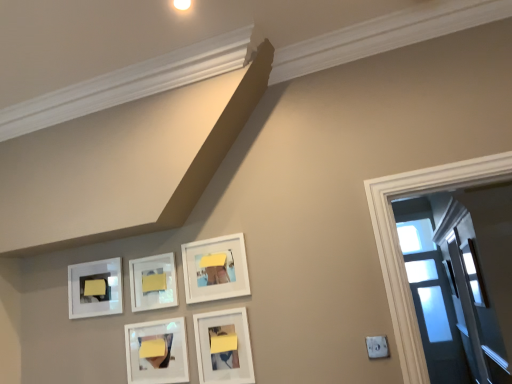
Locate an element on the screen. The width and height of the screenshot is (512, 384). matte white picture frame at lower center, which is counted as the first picture frame, starting from the right is located at coordinates (223, 347).

What do you see at coordinates (153, 282) in the screenshot? I see `white matte picture frame at center, positioned as the 2th picture frame in left-to-right order` at bounding box center [153, 282].

You are a GUI agent. You are given a task and a screenshot of the screen. Output one action in this format:
    pyautogui.click(x=<x>, y=<y>)
    Task: Click on the matte yellow paper at upper left, positioned as the first furniture in back-to-front order
    The width and height of the screenshot is (512, 384).
    Given the screenshot: What is the action you would take?
    pyautogui.click(x=95, y=287)

Image resolution: width=512 pixels, height=384 pixels. Describe the element at coordinates (473, 273) in the screenshot. I see `clear glass window at right` at that location.

The width and height of the screenshot is (512, 384). What do you see at coordinates (215, 269) in the screenshot?
I see `white matte picture frame at upper center, the 2th picture frame when ordered from right to left` at bounding box center [215, 269].

The image size is (512, 384). I want to click on matte white picture frame at lower center, the 3th picture frame when ordered from left to right, so click(157, 351).

This screenshot has width=512, height=384. What do you see at coordinates (154, 282) in the screenshot?
I see `yellow matte paper at center, the first furniture viewed from the right` at bounding box center [154, 282].

Identify the location of matte white picture frame at lower center, which is counted as the first picture frame, starting from the right. The image size is (512, 384). (223, 347).

From the image's perspective, is white matte picture frame at upper left, the 5th picture frame when ordered from right to left, beneath matte white picture frame at lower center, the 3th picture frame when ordered from left to right?

No.

Considering the relative sizes of white matte picture frame at upper left, the 5th picture frame when ordered from right to left, and matte white picture frame at lower center, which appears as the 3th picture frame when viewed from the right, in the image provided, is white matte picture frame at upper left, the 5th picture frame when ordered from right to left, thinner than matte white picture frame at lower center, which appears as the 3th picture frame when viewed from the right,?

Yes, white matte picture frame at upper left, the 5th picture frame when ordered from right to left, is thinner than matte white picture frame at lower center, which appears as the 3th picture frame when viewed from the right.

Who is more distant, white matte picture frame at upper left, the 5th picture frame when ordered from right to left, or matte white picture frame at lower center, the 3th picture frame when ordered from left to right?

white matte picture frame at upper left, the 5th picture frame when ordered from right to left.

Does matte yellow paper at upper left, positioned as the first furniture in back-to-front order, contain matte white picture frame at lower center, which is counted as the first picture frame, starting from the right?

No, matte white picture frame at lower center, which is counted as the first picture frame, starting from the right, is not surrounded by matte yellow paper at upper left, positioned as the first furniture in back-to-front order.

From the image's perspective, which one is positioned lower, matte yellow paper at upper left, which ranks as the 2th furniture in right-to-left order, or matte white picture frame at lower center, the fifth picture frame when ordered from left to right?

matte white picture frame at lower center, the fifth picture frame when ordered from left to right, from the image's perspective.

How many degrees apart are the facing directions of matte yellow paper at upper left, which ranks as the 2th furniture in right-to-left order, and matte white picture frame at lower center, which is counted as the first picture frame, starting from the right?

The angle between the facing direction of matte yellow paper at upper left, which ranks as the 2th furniture in right-to-left order, and the facing direction of matte white picture frame at lower center, which is counted as the first picture frame, starting from the right, is 0.293 degrees.

Considering the sizes of objects matte yellow paper at upper left, positioned as the first furniture in back-to-front order, and matte white picture frame at lower center, which is counted as the first picture frame, starting from the right, in the image provided, who is wider, matte yellow paper at upper left, positioned as the first furniture in back-to-front order, or matte white picture frame at lower center, which is counted as the first picture frame, starting from the right,?

Wider between the two is matte white picture frame at lower center, which is counted as the first picture frame, starting from the right.

Is matte white picture frame at lower center, which appears as the 3th picture frame when viewed from the right, not near white matte picture frame at upper left, the 1th picture frame positioned from the left?

matte white picture frame at lower center, which appears as the 3th picture frame when viewed from the right, is near white matte picture frame at upper left, the 1th picture frame positioned from the left, not far away.

Is matte white picture frame at lower center, which appears as the 3th picture frame when viewed from the right, bigger than white matte picture frame at upper left, the 5th picture frame when ordered from right to left?

Yes.

Considering the relative positions of matte white picture frame at lower center, which appears as the 3th picture frame when viewed from the right, and white matte picture frame at upper left, the 5th picture frame when ordered from right to left, in the image provided, is matte white picture frame at lower center, which appears as the 3th picture frame when viewed from the right, to the right of white matte picture frame at upper left, the 5th picture frame when ordered from right to left, from the viewer's perspective?

Yes, matte white picture frame at lower center, which appears as the 3th picture frame when viewed from the right, is to the right of white matte picture frame at upper left, the 5th picture frame when ordered from right to left.

From the image's perspective, would you say transparent glass door at right is positioned over matte white picture frame at lower center, the fifth picture frame when ordered from left to right?

No, from the image's perspective, transparent glass door at right is not over matte white picture frame at lower center, the fifth picture frame when ordered from left to right.

Is transparent glass door at right spatially inside matte white picture frame at lower center, which is counted as the first picture frame, starting from the right, or outside of it?

transparent glass door at right exists outside the volume of matte white picture frame at lower center, which is counted as the first picture frame, starting from the right.

Considering the positions of objects transparent glass door at right and matte white picture frame at lower center, which is counted as the first picture frame, starting from the right, in the image provided, who is in front, transparent glass door at right or matte white picture frame at lower center, which is counted as the first picture frame, starting from the right,?

matte white picture frame at lower center, which is counted as the first picture frame, starting from the right, is closer to the camera.

Would you say yellow matte paper at center, which is counted as the 2th furniture, starting from the back, is inside or outside white matte picture frame at center, the fourth picture frame when ordered from right to left?

yellow matte paper at center, which is counted as the 2th furniture, starting from the back, fits inside white matte picture frame at center, the fourth picture frame when ordered from right to left.

Could you measure the distance between yellow matte paper at center, the first furniture viewed from the right, and white matte picture frame at center, positioned as the 2th picture frame in left-to-right order?

yellow matte paper at center, the first furniture viewed from the right, is 1.36 inches away from white matte picture frame at center, positioned as the 2th picture frame in left-to-right order.

Locate an element on the screen. Image resolution: width=512 pixels, height=384 pixels. picture frame that is the 1st object to the left of the yellow matte paper at center, the second furniture positioned from the left, starting at the anchor is located at coordinates (153, 282).

Is yellow matte paper at center, the second furniture positioned from the left, next to white matte picture frame at center, positioned as the 2th picture frame in left-to-right order?

Yes, yellow matte paper at center, the second furniture positioned from the left, is right next to white matte picture frame at center, positioned as the 2th picture frame in left-to-right order, and making contact.

From a real-world perspective, which picture frame is the 1st one above the white matte picture frame at center, the fourth picture frame when ordered from right to left? Please provide its 2D coordinates.

[(215, 269)]

Can white matte picture frame at center, positioned as the 2th picture frame in left-to-right order, be found inside white matte picture frame at upper center, the 4th picture frame positioned from the left?

No, white matte picture frame at center, positioned as the 2th picture frame in left-to-right order, is not inside white matte picture frame at upper center, the 4th picture frame positioned from the left.

Considering the relative positions of white matte picture frame at upper center, the 2th picture frame when ordered from right to left, and white matte picture frame at center, the fourth picture frame when ordered from right to left, in the image provided, is white matte picture frame at upper center, the 2th picture frame when ordered from right to left, to the right of white matte picture frame at center, the fourth picture frame when ordered from right to left, from the viewer's perspective?

Indeed, white matte picture frame at upper center, the 2th picture frame when ordered from right to left, is positioned on the right side of white matte picture frame at center, the fourth picture frame when ordered from right to left.

How different are the orientations of white matte picture frame at center, positioned as the 2th picture frame in left-to-right order, and white matte picture frame at upper center, the 4th picture frame positioned from the left, in degrees?

The facing directions of white matte picture frame at center, positioned as the 2th picture frame in left-to-right order, and white matte picture frame at upper center, the 4th picture frame positioned from the left, are 0.0004 degrees apart.

Is white matte picture frame at center, the fourth picture frame when ordered from right to left, to the left of white matte picture frame at upper center, the 2th picture frame when ordered from right to left, from the viewer's perspective?

Yes, white matte picture frame at center, the fourth picture frame when ordered from right to left, is to the left of white matte picture frame at upper center, the 2th picture frame when ordered from right to left.

Is white matte picture frame at center, positioned as the 2th picture frame in left-to-right order, further to the viewer compared to white matte picture frame at upper center, the 2th picture frame when ordered from right to left?

Yes, the depth of white matte picture frame at center, positioned as the 2th picture frame in left-to-right order, is greater than that of white matte picture frame at upper center, the 2th picture frame when ordered from right to left.

From a real-world perspective, is white matte picture frame at center, positioned as the 2th picture frame in left-to-right order, on top of white matte picture frame at upper center, the 4th picture frame positioned from the left?

No, from a real-world perspective, white matte picture frame at center, positioned as the 2th picture frame in left-to-right order, is not above white matte picture frame at upper center, the 4th picture frame positioned from the left.

At what (x,y) coordinates should I click in order to perform the action: click on picture frame that is the 2nd object located below the white matte picture frame at upper left, the 1th picture frame positioned from the left (from the image's perspective). Please return your answer as a coordinate pair (x, y). The image size is (512, 384). Looking at the image, I should click on click(157, 351).

From a real-world perspective, count 2nd furnitures upward from the matte white picture frame at lower center, which is counted as the first picture frame, starting from the right, and point to it. Please provide its 2D coordinates.

[(95, 287)]

When comparing their distances from white matte picture frame at center, positioned as the 2th picture frame in left-to-right order, does matte white picture frame at lower center, which appears as the 3th picture frame when viewed from the right, or matte white picture frame at lower center, the fifth picture frame when ordered from left to right, seem further?

matte white picture frame at lower center, the fifth picture frame when ordered from left to right, is positioned further to the anchor white matte picture frame at center, positioned as the 2th picture frame in left-to-right order.

Based on their spatial positions, is matte white picture frame at lower center, the fifth picture frame when ordered from left to right, or matte white picture frame at lower center, the 3th picture frame when ordered from left to right, further from transparent glass door at right?

matte white picture frame at lower center, the 3th picture frame when ordered from left to right, lies further to transparent glass door at right than the other object.

Looking at this image, from the image, which object appears to be farther from yellow matte paper at center, which is counted as the first furniture, starting from the front, white matte picture frame at upper center, the 4th picture frame positioned from the left, or matte white picture frame at lower center, which appears as the 3th picture frame when viewed from the right?

matte white picture frame at lower center, which appears as the 3th picture frame when viewed from the right, is positioned further to the anchor yellow matte paper at center, which is counted as the first furniture, starting from the front.

From the image, which object appears to be nearer to clear glass window at right, white matte picture frame at upper center, the 4th picture frame positioned from the left, or transparent glass door at right?

transparent glass door at right is closer to clear glass window at right.

From the image, which object appears to be farther from white matte picture frame at upper left, the 5th picture frame when ordered from right to left, matte white picture frame at lower center, the 3th picture frame when ordered from left to right, or matte yellow paper at upper left, which is the first furniture from left to right?

matte white picture frame at lower center, the 3th picture frame when ordered from left to right, is positioned further to the anchor white matte picture frame at upper left, the 5th picture frame when ordered from right to left.

Looking at the image, which one is located closer to clear glass window at right, white matte picture frame at center, the fourth picture frame when ordered from right to left, or white matte picture frame at upper center, the 2th picture frame when ordered from right to left?

white matte picture frame at upper center, the 2th picture frame when ordered from right to left, is closer to clear glass window at right.

Which object lies further to the anchor point white matte picture frame at upper center, the 4th picture frame positioned from the left, white matte picture frame at center, the fourth picture frame when ordered from right to left, or matte yellow paper at upper left, which is the 2th furniture in front-to-back order?

Among the two, matte yellow paper at upper left, which is the 2th furniture in front-to-back order, is located further to white matte picture frame at upper center, the 4th picture frame positioned from the left.

When comparing their distances from white matte picture frame at upper left, the 1th picture frame positioned from the left, does clear glass window at right or matte white picture frame at lower center, which appears as the 3th picture frame when viewed from the right, seem closer?

matte white picture frame at lower center, which appears as the 3th picture frame when viewed from the right, is positioned closer to the anchor white matte picture frame at upper left, the 1th picture frame positioned from the left.

This screenshot has width=512, height=384. Identify the location of furniture between matte yellow paper at upper left, positioned as the first furniture in back-to-front order, and matte white picture frame at lower center, which is counted as the first picture frame, starting from the right, from left to right. (154, 282).

This screenshot has height=384, width=512. I want to click on furniture between matte yellow paper at upper left, which ranks as the 2th furniture in right-to-left order, and clear glass window at right from left to right, so click(154, 282).

You are a GUI agent. You are given a task and a screenshot of the screen. Output one action in this format:
    pyautogui.click(x=<x>, y=<y>)
    Task: Click on the furniture between yellow matte paper at center, the first furniture viewed from the right, and transparent glass door at right, along the z-axis
    
    Given the screenshot: What is the action you would take?
    pyautogui.click(x=95, y=287)

The width and height of the screenshot is (512, 384). Find the location of `window between yellow matte paper at center, which is counted as the 2th furniture, starting from the back, and transparent glass door at right from front to back`. window between yellow matte paper at center, which is counted as the 2th furniture, starting from the back, and transparent glass door at right from front to back is located at coordinates (473, 273).